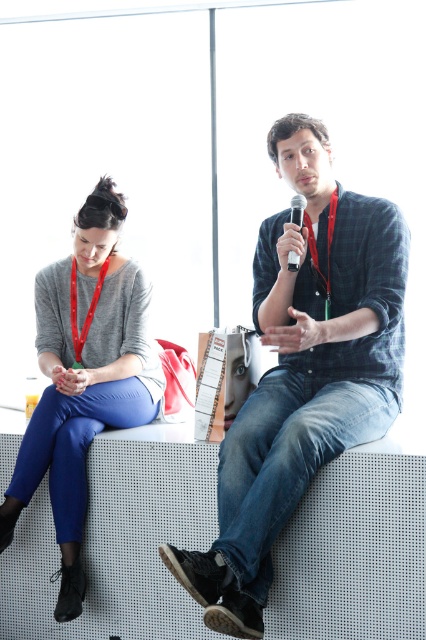
Question: Which object is positioned closest to the matte black microphone at center?

Choices:
 (A) red fabric lanyard at upper center
 (B) denim jeans at center

Answer: (A)

Question: Can you confirm if red fabric lanyard at upper center is wider than red fabric lanyard at upper left?

Choices:
 (A) no
 (B) yes

Answer: (A)

Question: Can you confirm if matte gray sweater at left is positioned to the left of red fabric lanyard at upper left?

Choices:
 (A) yes
 (B) no

Answer: (B)

Question: Is red fabric lanyard at upper center positioned before red fabric lanyard at upper left?

Choices:
 (A) yes
 (B) no

Answer: (A)

Question: Which point is closer to the camera taking this photo?

Choices:
 (A) (x=374, y=369)
 (B) (x=296, y=212)
 (C) (x=71, y=296)

Answer: (B)

Question: Based on their relative distances, which object is nearer to the matte black microphone at center?

Choices:
 (A) matte gray sweater at left
 (B) denim jeans at center
 (C) red fabric lanyard at upper center
 (D) red fabric lanyard at upper left

Answer: (C)